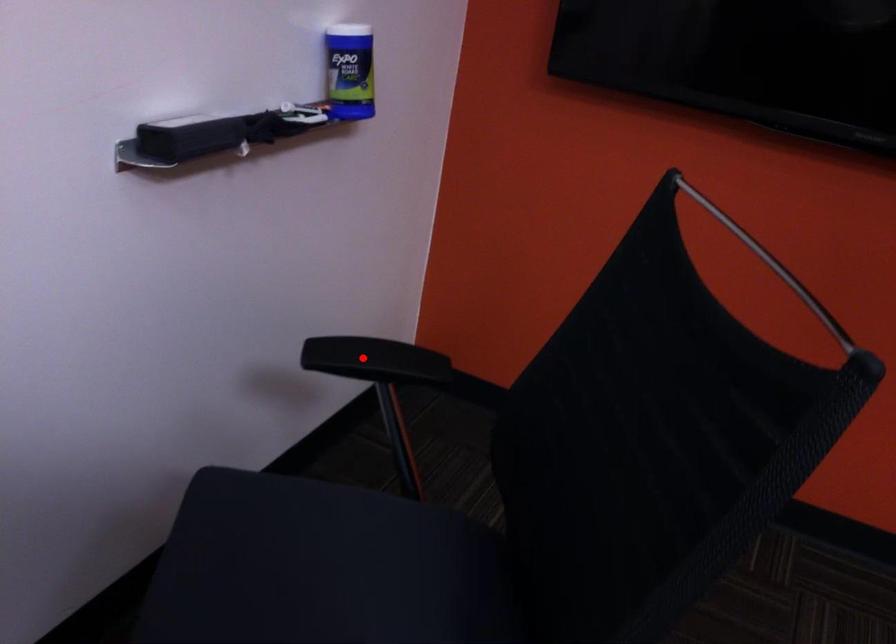
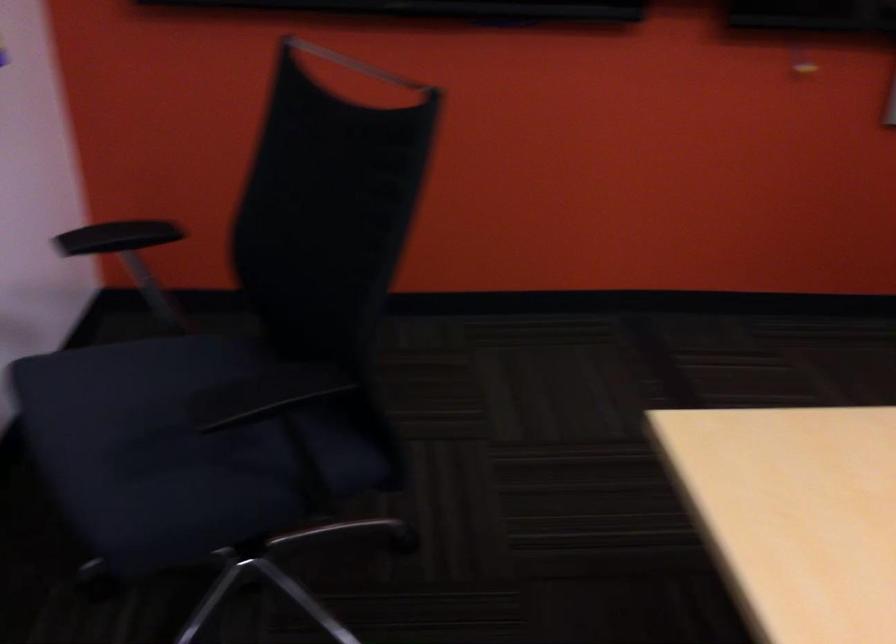
Where in the second image is the point corresponding to the highlighted location from the first image?

(117, 237)